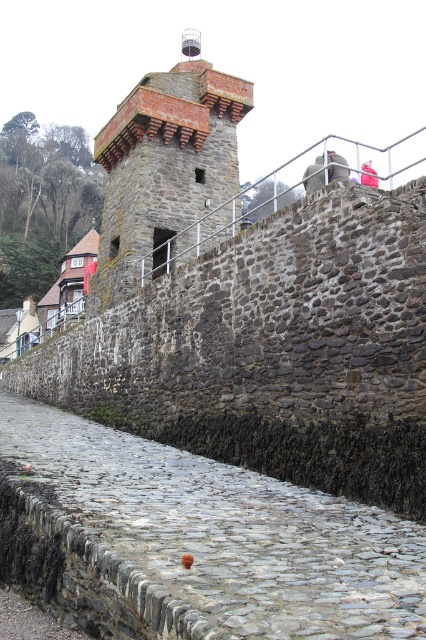
You are standing at the base of the historic stone wall and want to place a small decorative rock exactly at the cobblestone marked by point (230, 531). Can you confirm the location of this cobblestone relative to the wall?

The cobblestone at lower center is represented by point (230, 531), so it is located at the lower center position relative to the wall.

You are a delivery drone carrying a package that requires a landing zone at least 20 meters away from the cobblestone at lower center. You need to deliver to the rustic stone tower at center. Is the distance sufficient?

The distance between the cobblestone at lower center and rustic stone tower at center is 23.51 meters, which is more than the required 20 meters. Therefore, the landing zone at the rustic stone tower at center meets the distance requirement.